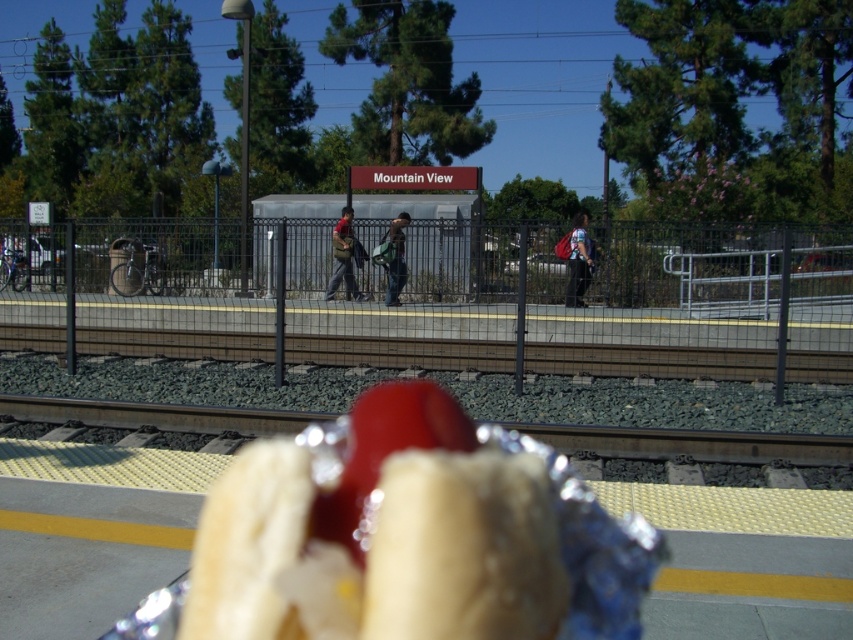
Question: Which object appears farthest from the camera in this image?

Choices:
 (A) denim jacket at center
 (B) shiny foil hot dog at center
 (C) matte brown backpack at center
 (D) green fabric backpack at center

Answer: (C)

Question: Can you confirm if shiny foil hot dog at center is smaller than green fabric backpack at center?

Choices:
 (A) yes
 (B) no

Answer: (A)

Question: Does matte brown backpack at center appear over green fabric backpack at center?

Choices:
 (A) no
 (B) yes

Answer: (B)

Question: Does shiny foil hot dog at center appear over matte brown backpack at center?

Choices:
 (A) yes
 (B) no

Answer: (B)

Question: Which of the following is the closest to the observer?

Choices:
 (A) (352, 241)
 (B) (459, 442)
 (C) (402, 216)
 (D) (569, 291)

Answer: (B)

Question: Among these points, which one is farthest from the camera?

Choices:
 (A) (436, 492)
 (B) (572, 275)
 (C) (396, 248)

Answer: (C)